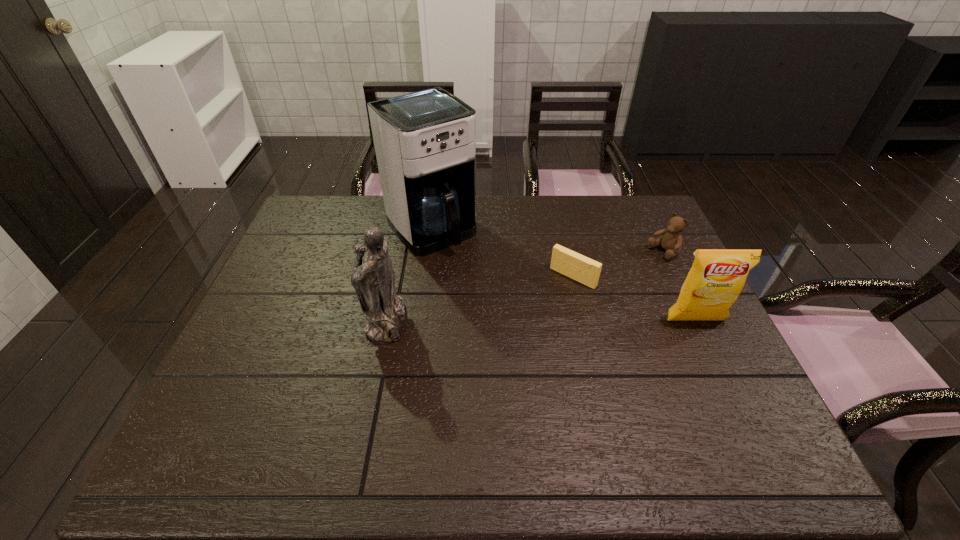
This screenshot has height=540, width=960. What are the coordinates of `free space on the desktop that is between the figurine and the crisp (potato chip) and is positioned on the front-facing side of the teddy bear` in the screenshot? It's located at (529, 320).

Identify the location of vacant space on the desktop that is between the fourth shortest object and the third shortest object and is positioned at the front of the videotape with spools. (534, 320).

Locate an element on the screen. Image resolution: width=960 pixels, height=540 pixels. free spot on the desktop that is between the second tallest object and the third shortest object and is positioned on the front panel of the coffee maker is located at coordinates (517, 320).